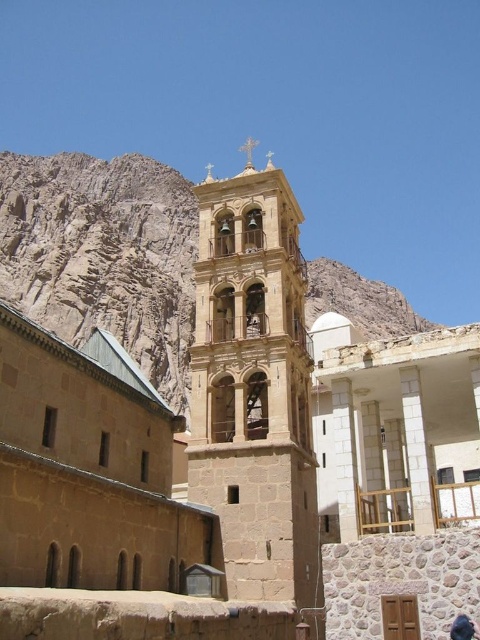
Question: Does brown rocky mountain at upper left appear on the left side of dark blue fabric at lower right?

Choices:
 (A) no
 (B) yes

Answer: (B)

Question: Which point appears closest to the camera in this image?

Choices:
 (A) (466, 614)
 (B) (142, 298)
 (C) (259, 436)

Answer: (A)

Question: Does stone bell tower at center appear under dark blue fabric at lower right?

Choices:
 (A) yes
 (B) no

Answer: (B)

Question: Estimate the real-world distances between objects in this image. Which object is closer to the brown rocky mountain at upper left?

Choices:
 (A) stone bell tower at center
 (B) dark blue fabric at lower right

Answer: (A)

Question: Does stone bell tower at center have a smaller size compared to brown rocky mountain at upper left?

Choices:
 (A) no
 (B) yes

Answer: (B)

Question: Which object is farther from the camera taking this photo?

Choices:
 (A) brown rocky mountain at upper left
 (B) stone bell tower at center

Answer: (A)